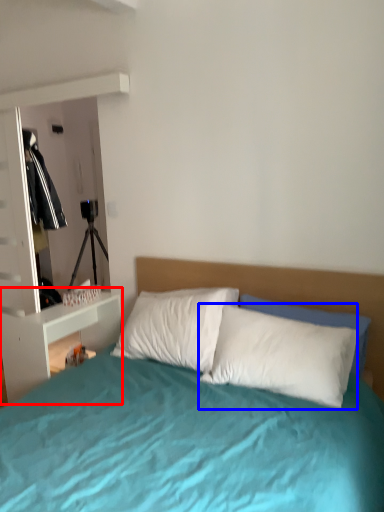
Question: Which point is further to the camera, nightstand (highlighted by a red box) or pillow (highlighted by a blue box)?

Choices:
 (A) nightstand
 (B) pillow

Answer: (A)